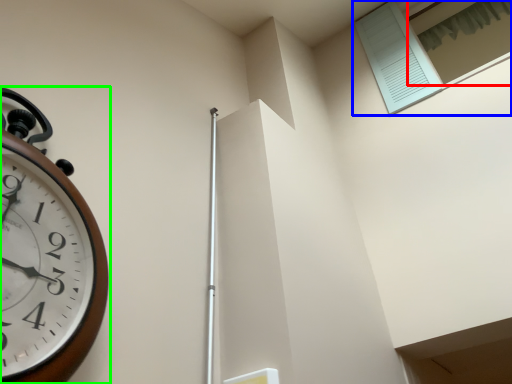
Question: Based on their relative distances, which object is nearer to window (highlighted by a red box)? Choose from window (highlighted by a blue box) and wall clock (highlighted by a green box).

Choices:
 (A) window
 (B) wall clock

Answer: (A)